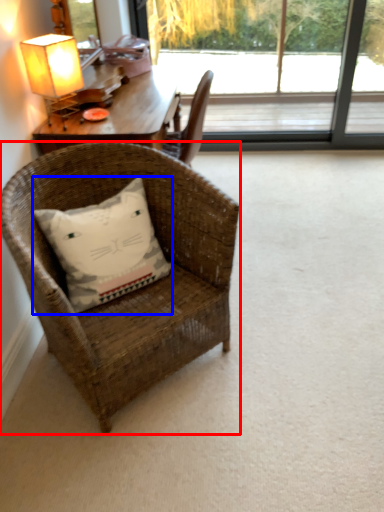
Question: Which object appears farthest to the camera in this image, chair (highlighted by a red box) or pillow (highlighted by a blue box)?

Choices:
 (A) chair
 (B) pillow

Answer: (B)